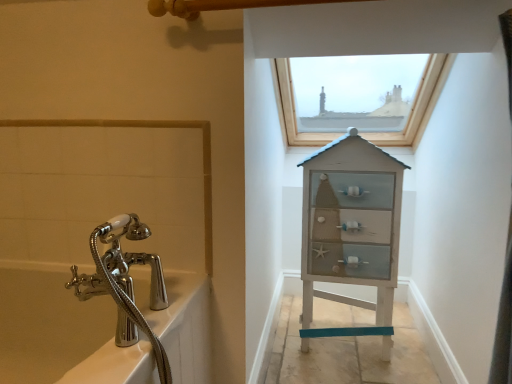
Question: Can you confirm if wooden frame window at upper center is thinner than white wood cabinet at center?

Choices:
 (A) no
 (B) yes

Answer: (A)

Question: Is wooden frame window at upper center not near white wood cabinet at center?

Choices:
 (A) no
 (B) yes

Answer: (A)

Question: Considering the relative positions of wooden frame window at upper center and white wood cabinet at center in the image provided, is wooden frame window at upper center behind white wood cabinet at center?

Choices:
 (A) yes
 (B) no

Answer: (A)

Question: Is wooden frame window at upper center bigger than white wood cabinet at center?

Choices:
 (A) no
 (B) yes

Answer: (B)

Question: Is wooden frame window at upper center next to white wood cabinet at center?

Choices:
 (A) no
 (B) yes

Answer: (A)

Question: Is white wood cabinet at center bigger or smaller than polished chrome bath at left?

Choices:
 (A) big
 (B) small

Answer: (B)

Question: From their relative heights in the image, would you say white wood cabinet at center is taller or shorter than polished chrome bath at left?

Choices:
 (A) short
 (B) tall

Answer: (B)

Question: Does point (305, 163) appear closer or farther from the camera than point (71, 331)?

Choices:
 (A) closer
 (B) farther

Answer: (B)

Question: From the image's perspective, is white wood cabinet at center above or below polished chrome bath at left?

Choices:
 (A) below
 (B) above

Answer: (B)

Question: In the image, is wooden frame window at upper center on the left side or the right side of polished chrome bath at left?

Choices:
 (A) left
 (B) right

Answer: (B)

Question: Which is correct: wooden frame window at upper center is inside polished chrome bath at left, or outside of it?

Choices:
 (A) outside
 (B) inside

Answer: (A)

Question: Looking at the image, does wooden frame window at upper center seem bigger or smaller compared to polished chrome bath at left?

Choices:
 (A) small
 (B) big

Answer: (A)

Question: From their relative heights in the image, would you say wooden frame window at upper center is taller or shorter than polished chrome bath at left?

Choices:
 (A) short
 (B) tall

Answer: (A)

Question: Would you say white wood cabinet at center is to the left or to the right of wooden frame window at upper center in the picture?

Choices:
 (A) right
 (B) left

Answer: (B)

Question: In terms of height, does white wood cabinet at center look taller or shorter compared to wooden frame window at upper center?

Choices:
 (A) short
 (B) tall

Answer: (B)